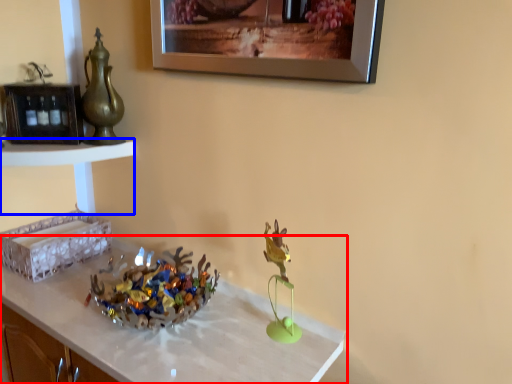
Question: Which object is closer to the camera taking this photo, table (highlighted by a red box) or vanity (highlighted by a blue box)?

Choices:
 (A) table
 (B) vanity

Answer: (A)